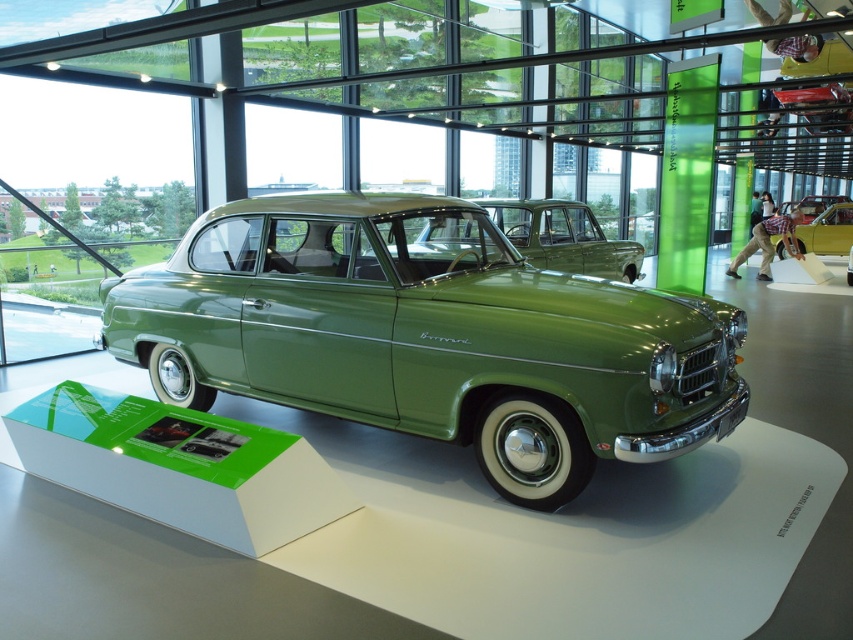
You are a tour guide explaining the Borgward car to visitors. You point out the green matte car at center and the green matte sedan at center. Which one is located to the left of the other?

The green matte car at center is positioned on the left side of green matte sedan at center.

You are a visitor at the car exhibition and want to take a photo of both the green matte car at center and the metallic gold car at center. Which car should you focus on first to ensure both are in the frame?

The green matte car at center is positioned under the metallic gold car at center, so you should focus on the metallic gold car at center first to ensure both are in the frame.

You are a tour guide explaining the layout of the car display. You mention both the green matte car at center and the green matte sedan at center. Which one is positioned lower in the image?

The green matte car at center is positioned below the green matte sedan at center, so it is lower in the image.